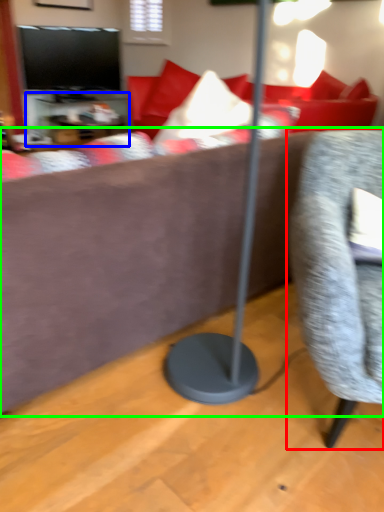
Question: Which is nearer to the chair (highlighted by a red box)? table (highlighted by a blue box) or studio couch (highlighted by a green box).

Choices:
 (A) table
 (B) studio couch

Answer: (B)